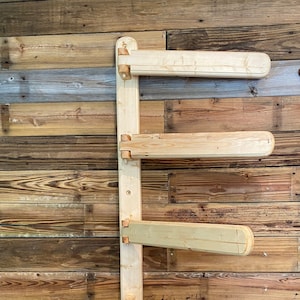
This screenshot has height=300, width=300. I want to click on dark brown wood, so [84, 246], [31, 10], [193, 39].